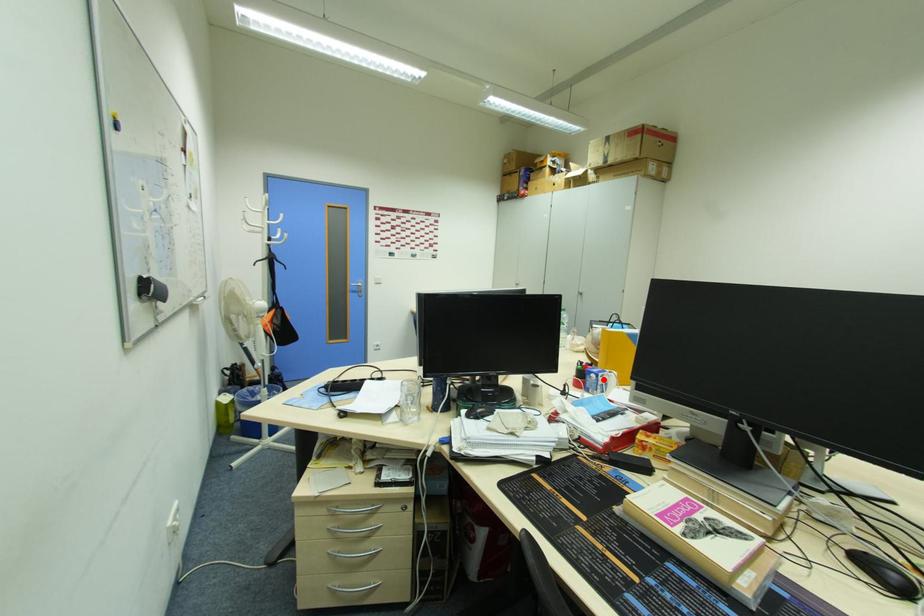
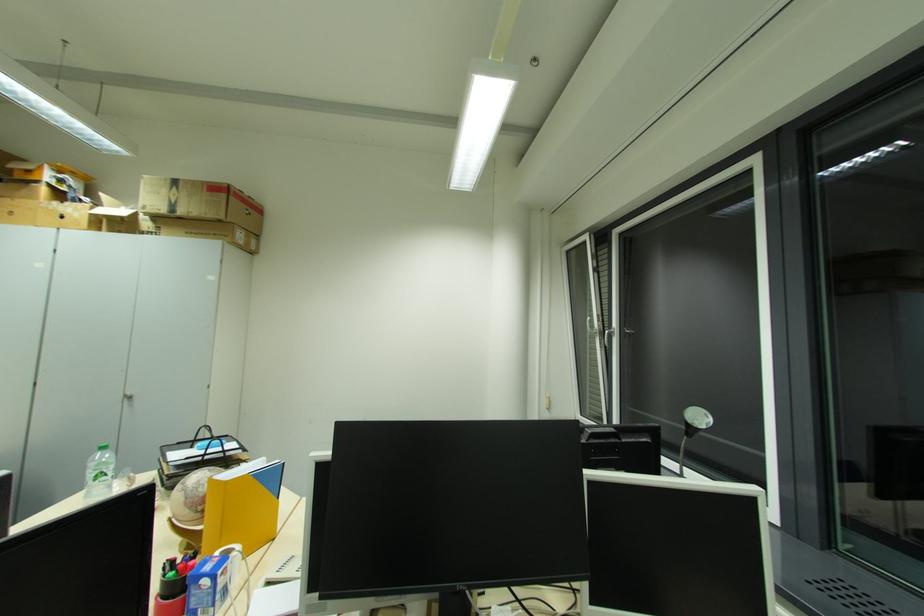
Locate, in the second image, the point that corresponds to the highlighted location in the first image.

(223, 582)